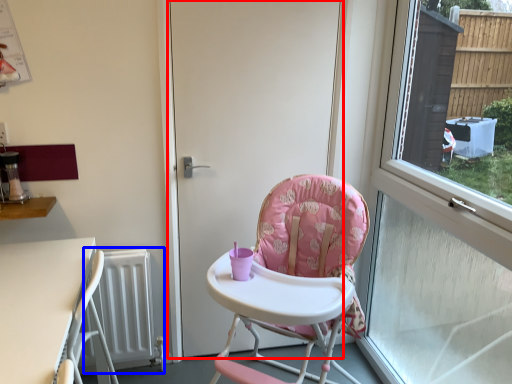
Question: Which object appears closest to the camera in this image, door (highlighted by a red box) or radiator (highlighted by a blue box)?

Choices:
 (A) door
 (B) radiator

Answer: (A)